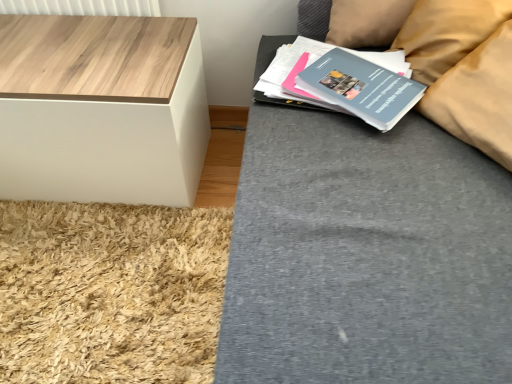
Where is `beige fabric pillow at upper right`? The height and width of the screenshot is (384, 512). beige fabric pillow at upper right is located at coordinates (447, 33).

What do you see at coordinates (101, 109) in the screenshot? This screenshot has width=512, height=384. I see `wooden white cube at left` at bounding box center [101, 109].

Identify the location of beige fabric pillow at upper right. This screenshot has width=512, height=384. (447, 33).

From the image's perspective, which one is positioned lower, matte blue paperback book at upper right, the 2th paperback book in the front-to-back sequence, or wooden white cube at left?

wooden white cube at left, from the image's perspective.

Is matte blue paperback book at upper right, the 1th paperback book viewed from the back, aimed at wooden white cube at left?

No, matte blue paperback book at upper right, the 1th paperback book viewed from the back, is not oriented towards wooden white cube at left.

In terms of width, does matte blue paperback book at upper right, the 1th paperback book viewed from the back, look wider or thinner when compared to wooden white cube at left?

matte blue paperback book at upper right, the 1th paperback book viewed from the back, is thinner than wooden white cube at left.

Is the surface of matte blue paperback book at upper right, the 2th paperback book in the front-to-back sequence, in direct contact with wooden white cube at left?

There is a gap between matte blue paperback book at upper right, the 2th paperback book in the front-to-back sequence, and wooden white cube at left.

Can matte gray paperback book at upper right, the second paperback book positioned from the back, be found inside matte blue paperback book at upper right, the 1th paperback book viewed from the back?

Indeed, matte gray paperback book at upper right, the second paperback book positioned from the back, is located within matte blue paperback book at upper right, the 1th paperback book viewed from the back.

Does matte blue paperback book at upper right, the 2th paperback book in the front-to-back sequence, lie in front of matte gray paperback book at upper right, the second paperback book positioned from the back?

That is False.

Where is `paperback book that appears on the left of matte gray paperback book at upper right, the second paperback book positioned from the back`? This screenshot has width=512, height=384. paperback book that appears on the left of matte gray paperback book at upper right, the second paperback book positioned from the back is located at coordinates (286, 70).

Does matte blue paperback book at upper right, the 1th paperback book viewed from the back, have a smaller size compared to matte gray paperback book at upper right, the first paperback book when ordered from front to back?

No, matte blue paperback book at upper right, the 1th paperback book viewed from the back, is not smaller than matte gray paperback book at upper right, the first paperback book when ordered from front to back.

From the image's perspective, does beige fabric pillow at upper right appear lower than wooden white cube at left?

No.

From a real-world perspective, which object rests below the other?

wooden white cube at left, from a real-world perspective.

What's the angular difference between beige fabric pillow at upper right and wooden white cube at left's facing directions?

3.82 degrees.

Can you confirm if beige fabric pillow at upper right is thinner than wooden white cube at left?

Yes.

From the image's perspective, is matte gray paperback book at upper right, the first paperback book when ordered from front to back, on top of matte blue paperback book at upper right, the 1th paperback book viewed from the back?

No, from the image's perspective, matte gray paperback book at upper right, the first paperback book when ordered from front to back, is not on top of matte blue paperback book at upper right, the 1th paperback book viewed from the back.

Is matte gray paperback book at upper right, the first paperback book when ordered from front to back, positioned with its back to matte blue paperback book at upper right, the 2th paperback book in the front-to-back sequence?

No, matte gray paperback book at upper right, the first paperback book when ordered from front to back, is not facing away from matte blue paperback book at upper right, the 2th paperback book in the front-to-back sequence.

Do you think matte gray paperback book at upper right, the second paperback book positioned from the back, is within matte blue paperback book at upper right, the 1th paperback book viewed from the back, or outside of it?

matte gray paperback book at upper right, the second paperback book positioned from the back, is enclosed within matte blue paperback book at upper right, the 1th paperback book viewed from the back.

Looking at this image, in terms of width, does matte gray paperback book at upper right, the second paperback book positioned from the back, look wider or thinner when compared to matte blue paperback book at upper right, the 1th paperback book viewed from the back?

In the image, matte gray paperback book at upper right, the second paperback book positioned from the back, appears to be more narrow than matte blue paperback book at upper right, the 1th paperback book viewed from the back.

From a real-world perspective, who is located higher, beige fabric pillow at upper right or matte gray paperback book at upper right, the first paperback book when ordered from front to back?

In real-world perspective, beige fabric pillow at upper right is above.

Considering the relative sizes of beige fabric pillow at upper right and matte gray paperback book at upper right, the first paperback book when ordered from front to back, in the image provided, is beige fabric pillow at upper right wider than matte gray paperback book at upper right, the first paperback book when ordered from front to back,?

Correct, the width of beige fabric pillow at upper right exceeds that of matte gray paperback book at upper right, the first paperback book when ordered from front to back.

Looking at this image, which is nearer, (456, 1) or (387, 87)?

Clearly, point (456, 1) is more distant from the camera than point (387, 87).

Considering the relative positions of beige fabric pillow at upper right and matte gray paperback book at upper right, the first paperback book when ordered from front to back, in the image provided, is beige fabric pillow at upper right to the left of matte gray paperback book at upper right, the first paperback book when ordered from front to back, from the viewer's perspective?

Incorrect, beige fabric pillow at upper right is not on the left side of matte gray paperback book at upper right, the first paperback book when ordered from front to back.

Is wooden white cube at left bigger than beige fabric pillow at upper right?

Correct, wooden white cube at left is larger in size than beige fabric pillow at upper right.

Which is more to the right, wooden white cube at left or beige fabric pillow at upper right?

beige fabric pillow at upper right is more to the right.

Identify the location of pillow that is on the right side of wooden white cube at left. (447, 33).

Which is less distant, (133, 112) or (439, 39)?

Point (133, 112).

Would you say wooden white cube at left is to the left or to the right of matte gray paperback book at upper right, the first paperback book when ordered from front to back, in the picture?

Based on their positions, wooden white cube at left is located to the left of matte gray paperback book at upper right, the first paperback book when ordered from front to back.

Is matte gray paperback book at upper right, the first paperback book when ordered from front to back, inside wooden white cube at left?

No, wooden white cube at left does not contain matte gray paperback book at upper right, the first paperback book when ordered from front to back.

From a real-world perspective, is wooden white cube at left physically located above or below matte gray paperback book at upper right, the second paperback book positioned from the back?

Clearly, from a real-world perspective, wooden white cube at left is below matte gray paperback book at upper right, the second paperback book positioned from the back.

In the scene shown: Does wooden white cube at left lie in front of matte gray paperback book at upper right, the first paperback book when ordered from front to back?

No, wooden white cube at left is further to the viewer.

Identify the location of the 1st paperback book positioned above the wooden white cube at left (from a real-world perspective). This screenshot has height=384, width=512. (286, 70).

Where is `paperback book located behind the matte gray paperback book at upper right, the second paperback book positioned from the back`? The width and height of the screenshot is (512, 384). paperback book located behind the matte gray paperback book at upper right, the second paperback book positioned from the back is located at coordinates (286, 70).

Considering their positions, is matte gray paperback book at upper right, the second paperback book positioned from the back, positioned further to wooden white cube at left than matte blue paperback book at upper right, the 1th paperback book viewed from the back?

matte gray paperback book at upper right, the second paperback book positioned from the back, is positioned further to the anchor wooden white cube at left.

Considering their positions, is beige fabric pillow at upper right positioned further to matte blue paperback book at upper right, the 1th paperback book viewed from the back, than matte gray paperback book at upper right, the first paperback book when ordered from front to back?

beige fabric pillow at upper right is further to matte blue paperback book at upper right, the 1th paperback book viewed from the back.

Considering their positions, is matte gray paperback book at upper right, the first paperback book when ordered from front to back, positioned closer to wooden white cube at left than beige fabric pillow at upper right?

Based on the image, matte gray paperback book at upper right, the first paperback book when ordered from front to back, appears to be nearer to wooden white cube at left.

Which object lies nearer to the anchor point matte gray paperback book at upper right, the second paperback book positioned from the back, matte blue paperback book at upper right, the 1th paperback book viewed from the back, or beige fabric pillow at upper right?

Based on the image, matte blue paperback book at upper right, the 1th paperback book viewed from the back, appears to be nearer to matte gray paperback book at upper right, the second paperback book positioned from the back.

Based on their spatial positions, is beige fabric pillow at upper right or matte blue paperback book at upper right, the 1th paperback book viewed from the back, further from matte gray paperback book at upper right, the first paperback book when ordered from front to back?

beige fabric pillow at upper right lies further to matte gray paperback book at upper right, the first paperback book when ordered from front to back, than the other object.

When comparing their distances from matte gray paperback book at upper right, the second paperback book positioned from the back, does beige fabric pillow at upper right or wooden white cube at left seem further?

The object further to matte gray paperback book at upper right, the second paperback book positioned from the back, is wooden white cube at left.

Considering their positions, is matte blue paperback book at upper right, the 1th paperback book viewed from the back, positioned closer to wooden white cube at left than beige fabric pillow at upper right?

matte blue paperback book at upper right, the 1th paperback book viewed from the back, is positioned closer to the anchor wooden white cube at left.

Estimate the real-world distances between objects in this image. Which object is closer to wooden white cube at left, beige fabric pillow at upper right or matte blue paperback book at upper right, the 2th paperback book in the front-to-back sequence?

matte blue paperback book at upper right, the 2th paperback book in the front-to-back sequence, is closer to wooden white cube at left.

Locate an element on the screen. This screenshot has height=384, width=512. paperback book situated between wooden white cube at left and matte gray paperback book at upper right, the first paperback book when ordered from front to back, from left to right is located at coordinates (286, 70).

At what (x,y) coordinates should I click in order to perform the action: click on paperback book between beige fabric pillow at upper right and matte gray paperback book at upper right, the second paperback book positioned from the back, vertically. Please return your answer as a coordinate pair (x, y). The height and width of the screenshot is (384, 512). Looking at the image, I should click on (286, 70).